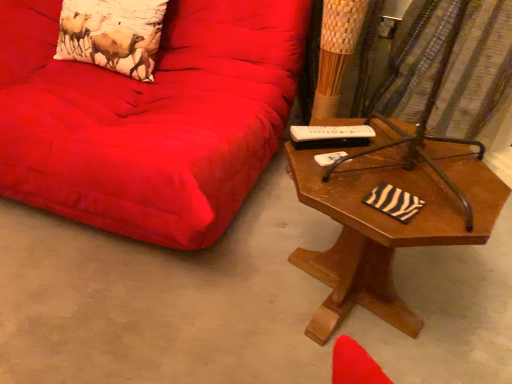
Question: Does suede red couch at upper left have a larger size compared to brown wooden table at right?

Choices:
 (A) yes
 (B) no

Answer: (A)

Question: Is suede red couch at upper left taller than brown wooden table at right?

Choices:
 (A) yes
 (B) no

Answer: (A)

Question: Is suede red couch at upper left at the left side of brown wooden table at right?

Choices:
 (A) yes
 (B) no

Answer: (A)

Question: Is suede red couch at upper left not close to brown wooden table at right?

Choices:
 (A) yes
 (B) no

Answer: (B)

Question: Is suede red couch at upper left smaller than brown wooden table at right?

Choices:
 (A) yes
 (B) no

Answer: (B)

Question: From a real-world perspective, is suede red couch at upper left over brown wooden table at right?

Choices:
 (A) yes
 (B) no

Answer: (A)

Question: Is brown wooden table at right located outside suede red couch at upper left?

Choices:
 (A) no
 (B) yes

Answer: (B)

Question: Is suede red couch at upper left at the back of brown wooden table at right?

Choices:
 (A) yes
 (B) no

Answer: (B)

Question: From the image's perspective, would you say brown wooden table at right is positioned over suede red couch at upper left?

Choices:
 (A) no
 (B) yes

Answer: (A)

Question: Considering the relative sizes of brown wooden table at right and suede red couch at upper left in the image provided, is brown wooden table at right shorter than suede red couch at upper left?

Choices:
 (A) no
 (B) yes

Answer: (B)

Question: Is brown wooden table at right wider than suede red couch at upper left?

Choices:
 (A) no
 (B) yes

Answer: (B)

Question: Does brown wooden table at right appear on the right side of suede red couch at upper left?

Choices:
 (A) yes
 (B) no

Answer: (A)

Question: Is brown wooden table at right in front of brown metal swivel chair at right?

Choices:
 (A) yes
 (B) no

Answer: (A)